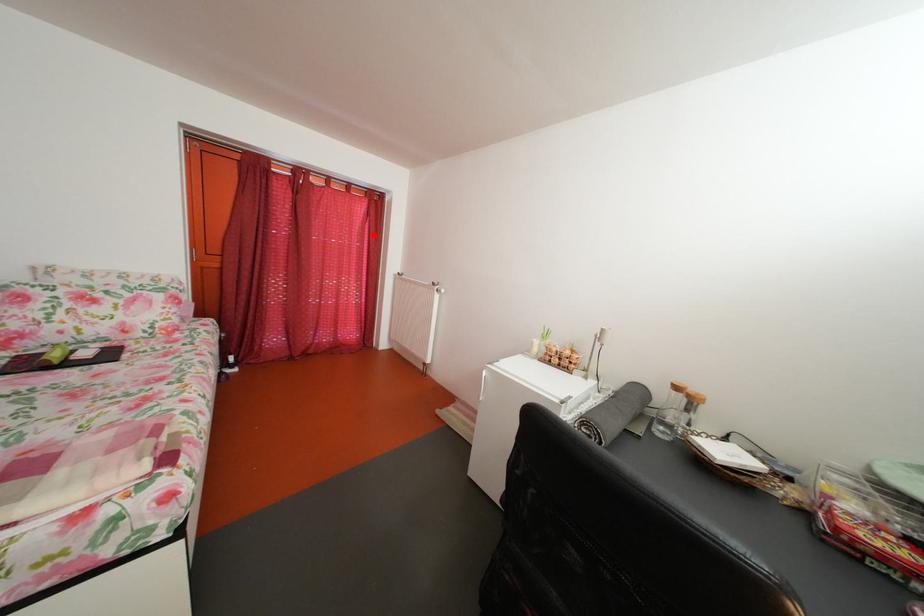
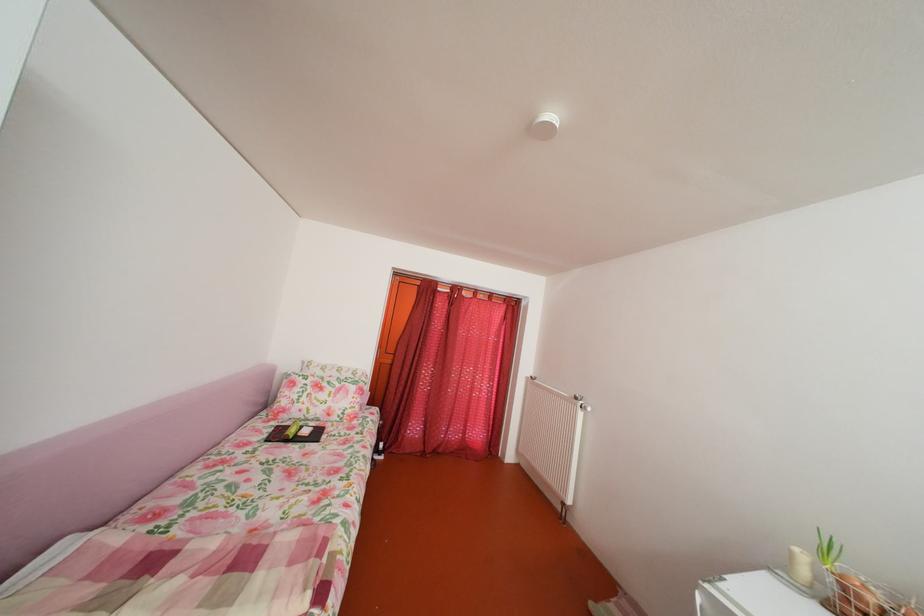
Question: I am providing you with two images of the same scene from different viewpoints. Image1 has a red point marked. In image2, the corresponding 3D location appears at what relative position? Reply with the corresponding letter.

Choices:
 (A) Closer
 (B) Farther

Answer: (B)